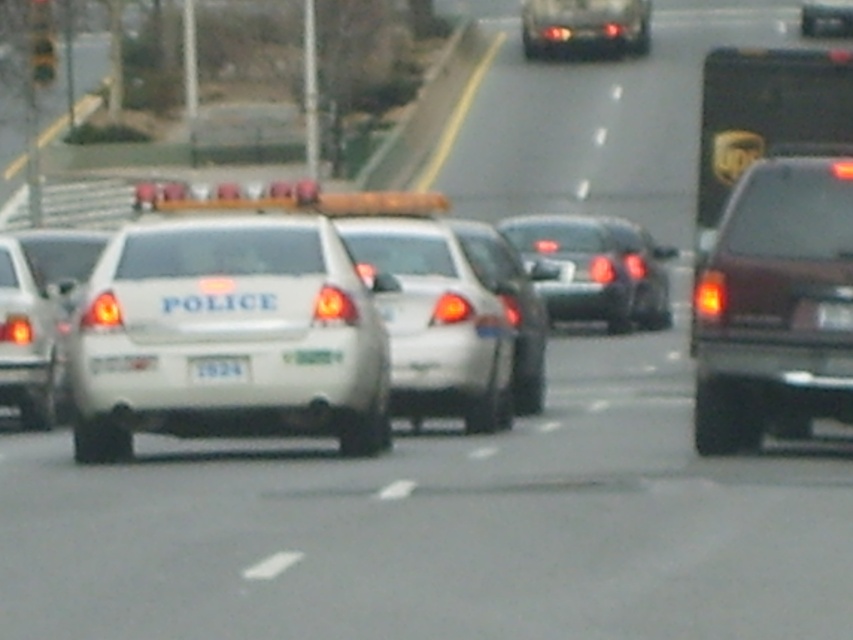
You are a driver approaching the intersection where the yellow matte traffic light at upper left and the white plastic license plate at center are visible. Which object is taller?

The yellow matte traffic light at upper left is taller than the white plastic license plate at center.

You are a driver approaching the police car with its rear facing you. You notice a glossy black sedan at center and a white plastic license plate at center. Which object is larger in size?

The glossy black sedan at center is bigger than the white plastic license plate at center, so the glossy black sedan at center is larger in size.